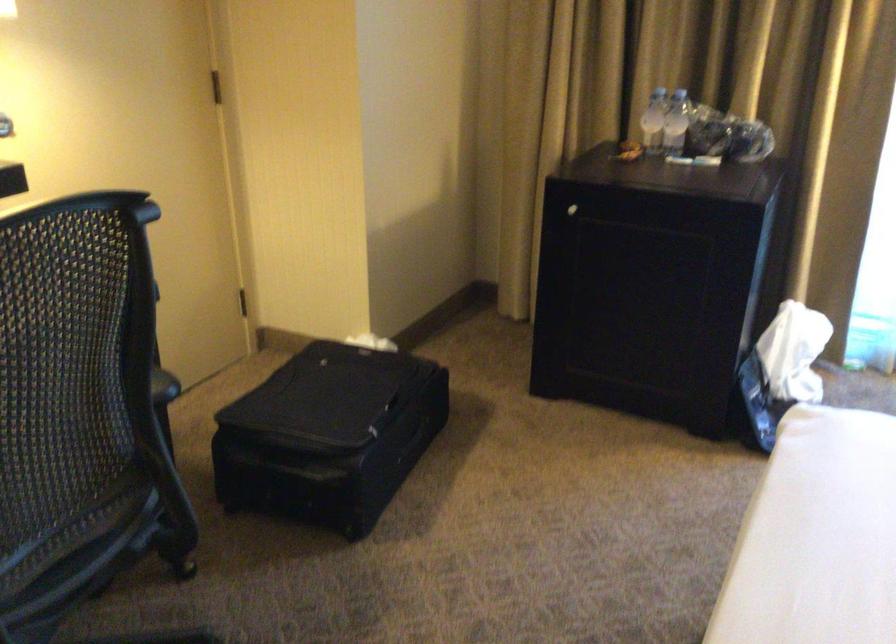
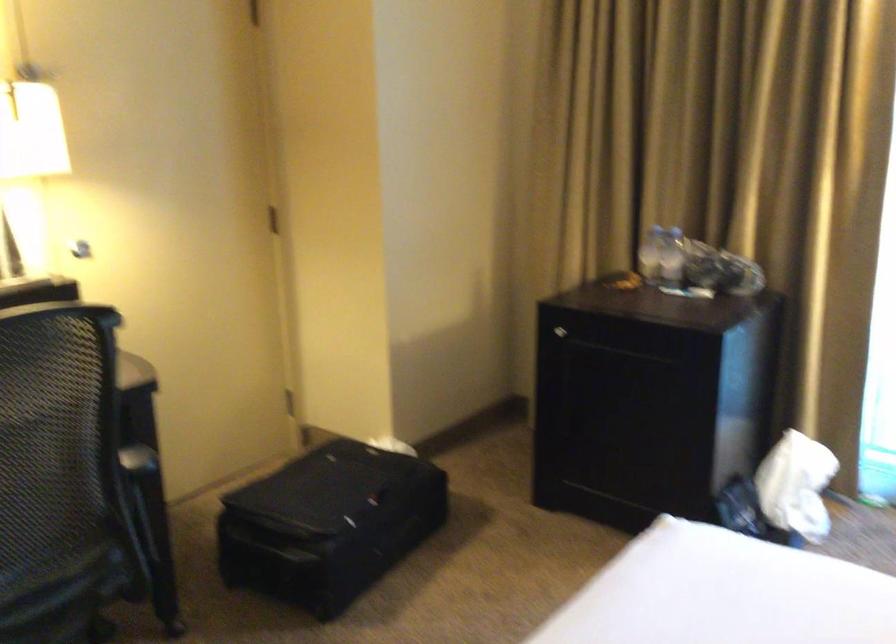
In the second image, find the point that corresponds to (675,124) in the first image.

(670, 257)